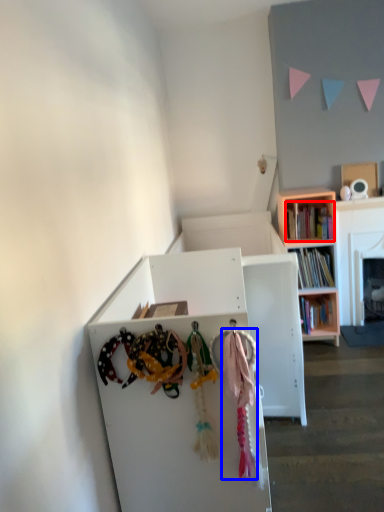
Question: Which of the following is the farthest to the observer, book (highlighted by a red box) or clothesline (highlighted by a blue box)?

Choices:
 (A) book
 (B) clothesline

Answer: (A)